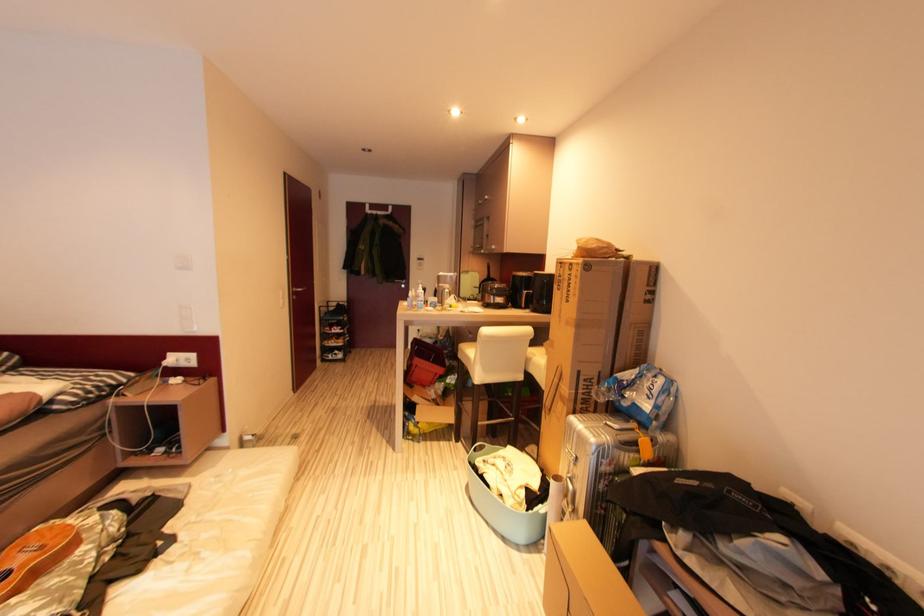
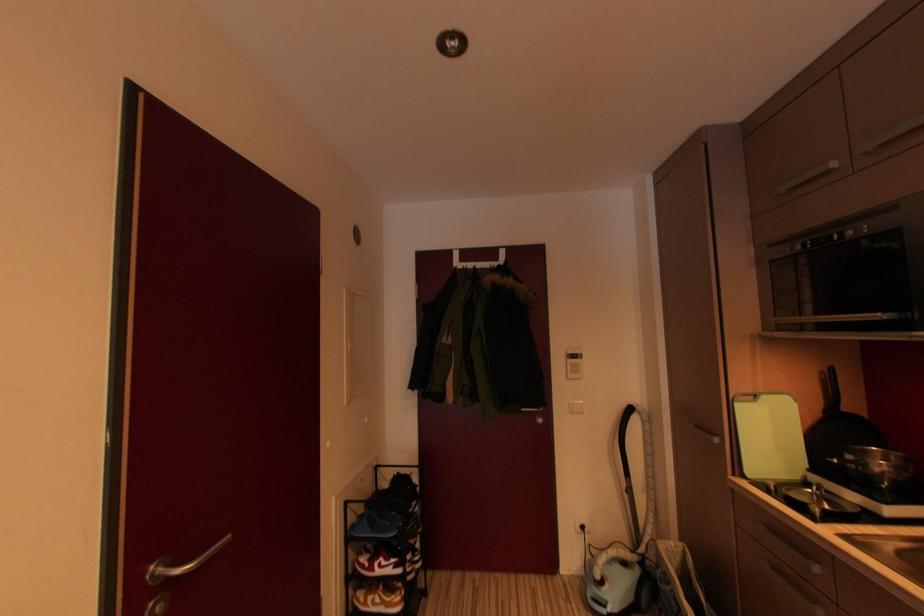
Question: The images are taken continuously from a first-person perspective. In which direction are you moving?

Choices:
 (A) Left
 (B) Right
 (C) Forward
 (D) Backward

Answer: (C)